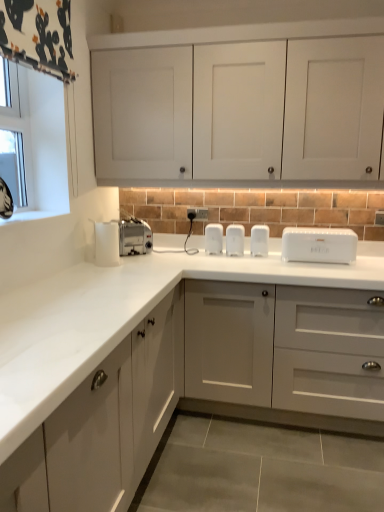
Question: Does silver metallic toaster at center turn towards white matte cabinet doors at upper center, positioned as the 2th cabinetry in bottom-to-top order?

Choices:
 (A) no
 (B) yes

Answer: (A)

Question: Can you confirm if silver metallic toaster at center is smaller than white matte cabinet doors at upper center, marked as the 1th cabinetry in a top-to-bottom arrangement?

Choices:
 (A) no
 (B) yes

Answer: (B)

Question: Could white matte cabinet doors at upper center, positioned as the 2th cabinetry in bottom-to-top order, be considered to be inside silver metallic toaster at center?

Choices:
 (A) no
 (B) yes

Answer: (A)

Question: Can you confirm if silver metallic toaster at center is positioned to the right of white matte cabinet doors at upper center, positioned as the 2th cabinetry in bottom-to-top order?

Choices:
 (A) yes
 (B) no

Answer: (B)

Question: From a real-world perspective, is silver metallic toaster at center located beneath white matte cabinet doors at upper center, marked as the 1th cabinetry in a top-to-bottom arrangement?

Choices:
 (A) no
 (B) yes

Answer: (B)

Question: Is white matte cabinet doors at upper center, positioned as the 2th cabinetry in bottom-to-top order, in front of or behind satin silver toaster at left, which appears as the 4th appliance when viewed from the right, in the image?

Choices:
 (A) behind
 (B) front

Answer: (B)

Question: Considering the positions of white matte cabinet doors at upper center, marked as the 1th cabinetry in a top-to-bottom arrangement, and satin silver toaster at left, which appears as the 4th appliance when viewed from the right, in the image, is white matte cabinet doors at upper center, marked as the 1th cabinetry in a top-to-bottom arrangement, bigger or smaller than satin silver toaster at left, which appears as the 4th appliance when viewed from the right,?

Choices:
 (A) big
 (B) small

Answer: (A)

Question: Is white matte cabinet doors at upper center, positioned as the 2th cabinetry in bottom-to-top order, taller or shorter than satin silver toaster at left, which is the 1th appliance in left-to-right order?

Choices:
 (A) short
 (B) tall

Answer: (B)

Question: Is point (168, 42) positioned closer to the camera than point (150, 243)?

Choices:
 (A) closer
 (B) farther

Answer: (A)

Question: Considering the positions of point (301, 260) and point (281, 76), is point (301, 260) closer or farther from the camera than point (281, 76)?

Choices:
 (A) closer
 (B) farther

Answer: (B)

Question: In terms of height, does white plastic bread bin at center look taller or shorter compared to white matte cabinet doors at upper center, marked as the 1th cabinetry in a top-to-bottom arrangement?

Choices:
 (A) tall
 (B) short

Answer: (B)

Question: Considering the positions of white plastic bread bin at center and white matte cabinet doors at upper center, marked as the 1th cabinetry in a top-to-bottom arrangement, in the image, is white plastic bread bin at center wider or thinner than white matte cabinet doors at upper center, marked as the 1th cabinetry in a top-to-bottom arrangement,?

Choices:
 (A) wide
 (B) thin

Answer: (B)

Question: From a real-world perspective, relative to white matte cabinet doors at upper center, positioned as the 2th cabinetry in bottom-to-top order, is white plastic bread bin at center vertically above or below?

Choices:
 (A) below
 (B) above

Answer: (A)

Question: Is white plastic bread bin at center wider or thinner than clear glass window at upper left?

Choices:
 (A) wide
 (B) thin

Answer: (A)

Question: Based on their sizes in the image, would you say white plastic bread bin at center is bigger or smaller than clear glass window at upper left?

Choices:
 (A) big
 (B) small

Answer: (A)